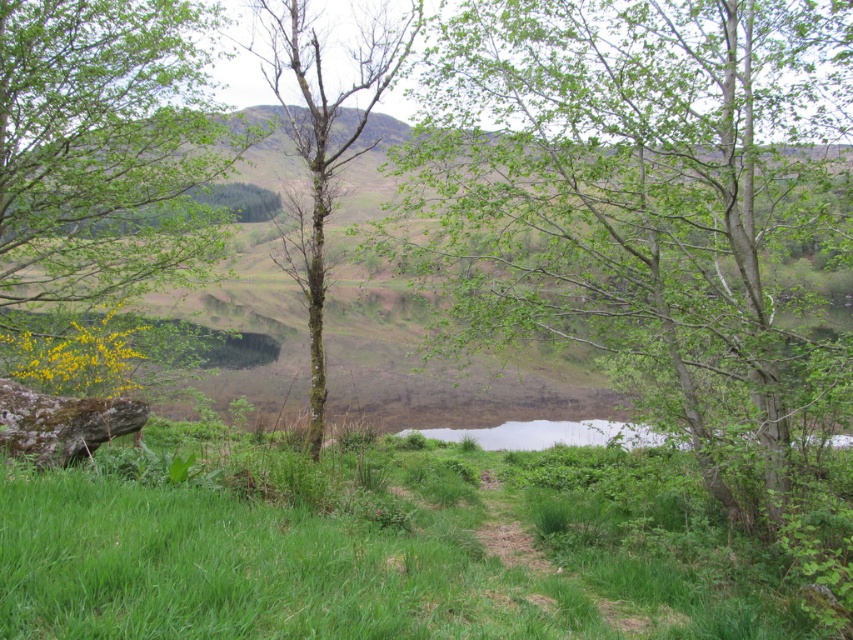
Consider the image. Can you confirm if green leafy tree at center is wider than green grassy at center?

In fact, green leafy tree at center might be narrower than green grassy at center.

Between green leafy tree at center and green grassy at center, which one has less height?

green grassy at center is shorter.

Find the location of a particular element. Image resolution: width=853 pixels, height=640 pixels. green leafy tree at center is located at coordinates (635, 193).

You are a GUI agent. You are given a task and a screenshot of the screen. Output one action in this format:
    pyautogui.click(x=<x>, y=<y>)
    Task: Click on the green leafy tree at center
    
    Given the screenshot: What is the action you would take?
    (x=635, y=193)

Which is in front, point (809, 22) or point (73, 220)?

Point (809, 22) is more forward.

Is point (729, 115) closer to camera compared to point (22, 307)?

Yes, it is in front of point (22, 307).

Find the location of `green leafy tree at center`. green leafy tree at center is located at coordinates (635, 193).

Does green leafy tree at left have a smaller size compared to bare bark tree at center?

Indeed, green leafy tree at left has a smaller size compared to bare bark tree at center.

Does green leafy tree at left appear on the right side of bare bark tree at center?

In fact, green leafy tree at left is to the left of bare bark tree at center.

Between point (158, 131) and point (352, 74), which one is positioned in front?

Point (158, 131) is more forward.

The width and height of the screenshot is (853, 640). Find the location of `green leafy tree at left`. green leafy tree at left is located at coordinates (105, 154).